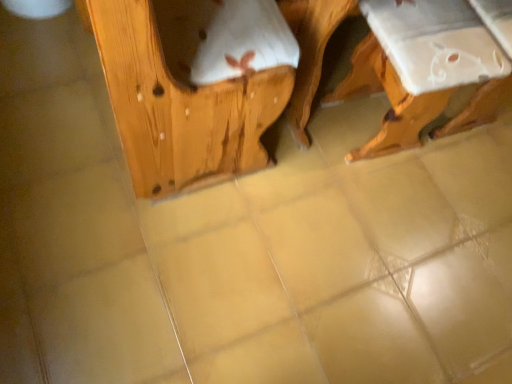
Describe the element at coordinates (422, 69) in the screenshot. I see `white glossy table at upper right` at that location.

Identify the location of white glossy table at upper right. (422, 69).

What are the coordinates of `white glossy table at upper right` in the screenshot? It's located at (422, 69).